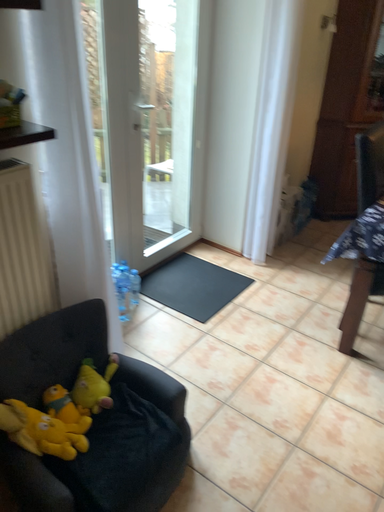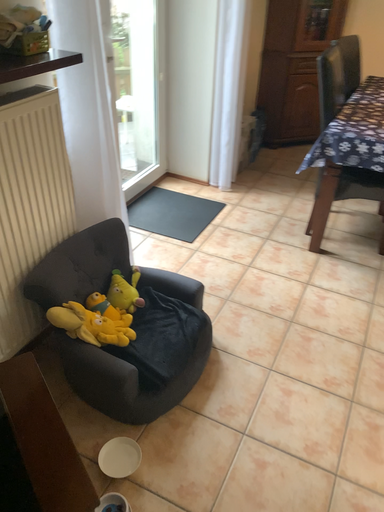
Question: Which way did the camera rotate in the video?

Choices:
 (A) rotated left
 (B) rotated right

Answer: (B)